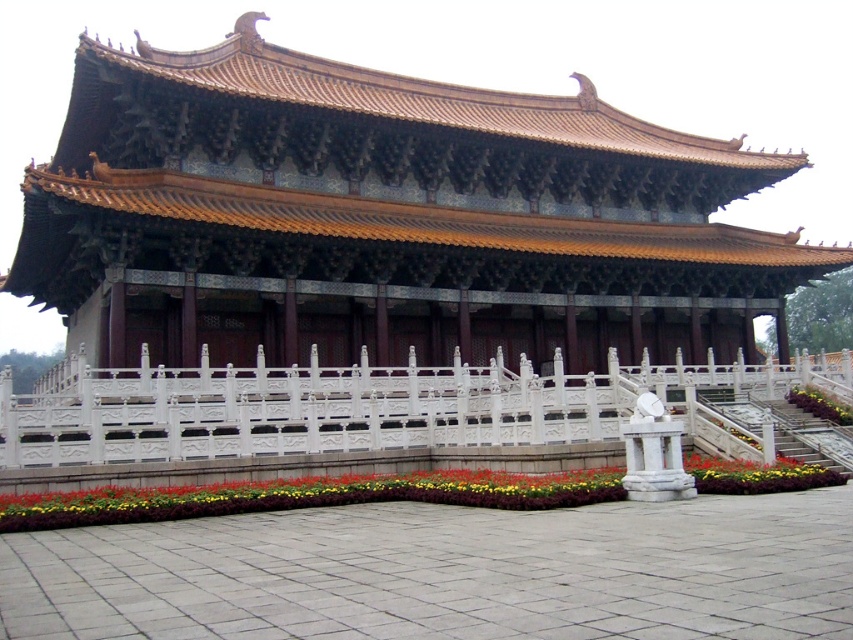
You are standing at the entrance of the traditional Chinese structure and want to locate the golden glazed tile roof at center. According to the coordinate system where the bottom left corner is the origin, what are its coordinates?

The golden glazed tile roof at center is located at coordinates point (387, 218).

You are standing at the entrance of the traditional Chinese pavilion and want to take a photo of the golden glazed tile roof at center. If your camera has a maximum focus range of 100 feet, will it be able to capture the roof clearly?

The golden glazed tile roof at center is 113.87 feet away from the camera. Since this distance exceeds the camera maximum focus range of 100 feet, the camera will not be able to capture the roof clearly.